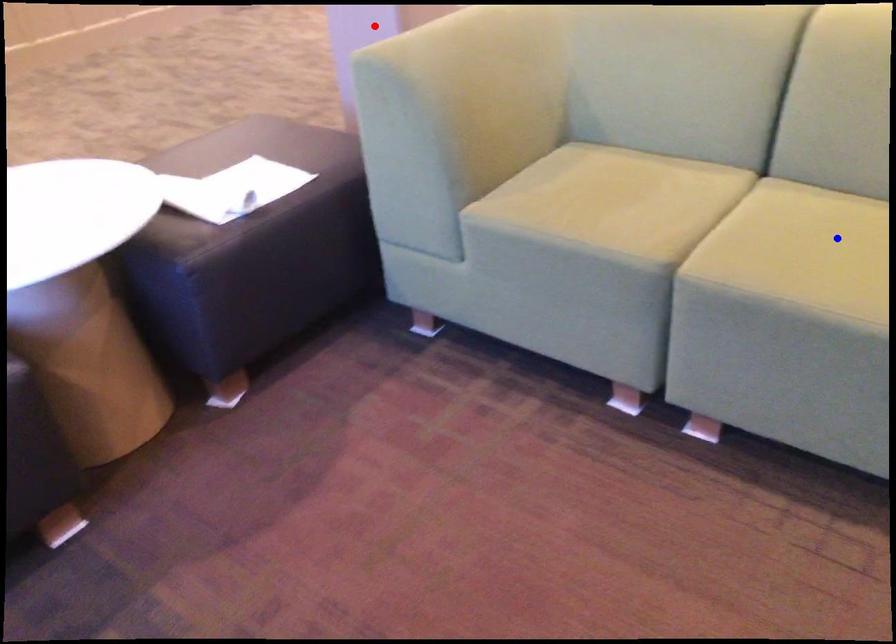
Question: In the image, two points are highlighted. Which point is nearer to the camera? Reply with the corresponding letter.

Choices:
 (A) blue point
 (B) red point

Answer: (A)